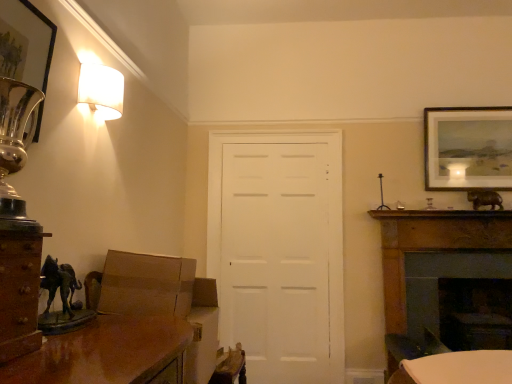
Question: From the image's perspective, is matte gold picture frame at upper right, the second picture frame from the left, positioned above or below white matte door at center?

Choices:
 (A) above
 (B) below

Answer: (A)

Question: In terms of size, does matte gold picture frame at upper right, the second picture frame positioned from the front, appear bigger or smaller than white matte door at center?

Choices:
 (A) big
 (B) small

Answer: (B)

Question: Which of these objects is positioned farthest from the brown wood cabinet at left?

Choices:
 (A) white glossy table at lower right
 (B) dark wood fireplace at right, acting as the 2th fireplace starting from the back
 (C) matte gold picture frame at upper right, the first picture frame viewed from the back
 (D) dark wood fireplace at lower right, arranged as the 1th fireplace when viewed from the back
 (E) metallic silver picture frame at upper left, acting as the 2th picture frame starting from the right

Answer: (C)

Question: Based on their relative distances, which object is farther from the metallic silver picture frame at upper left, acting as the 1th picture frame starting from the left?

Choices:
 (A) white glossy table at lower right
 (B) white fabric lampshade at upper left
 (C) brown wood cabinet at left
 (D) dark wood fireplace at lower right, arranged as the 1th fireplace when viewed from the back
 (E) dark wood fireplace at right, which is counted as the 1th fireplace, starting from the front

Answer: (D)